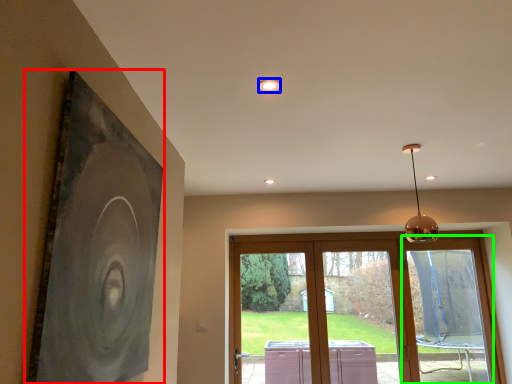
Question: Which is farther away from picture frame (highlighted by a red box)? lighting (highlighted by a blue box) or window (highlighted by a green box)?

Choices:
 (A) lighting
 (B) window

Answer: (B)